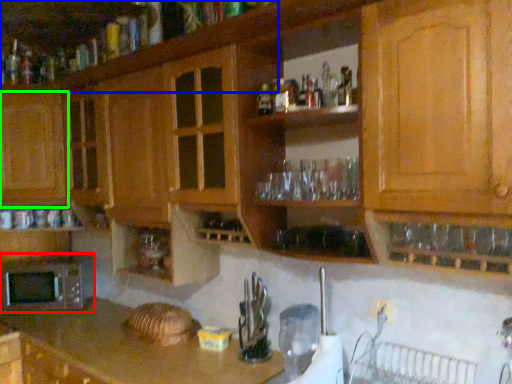
Question: Based on their relative distances, which object is farther from microwave oven (highlighted by a red box)? Choose from cabinetry (highlighted by a blue box) and cabinetry (highlighted by a green box).

Choices:
 (A) cabinetry
 (B) cabinetry

Answer: (A)